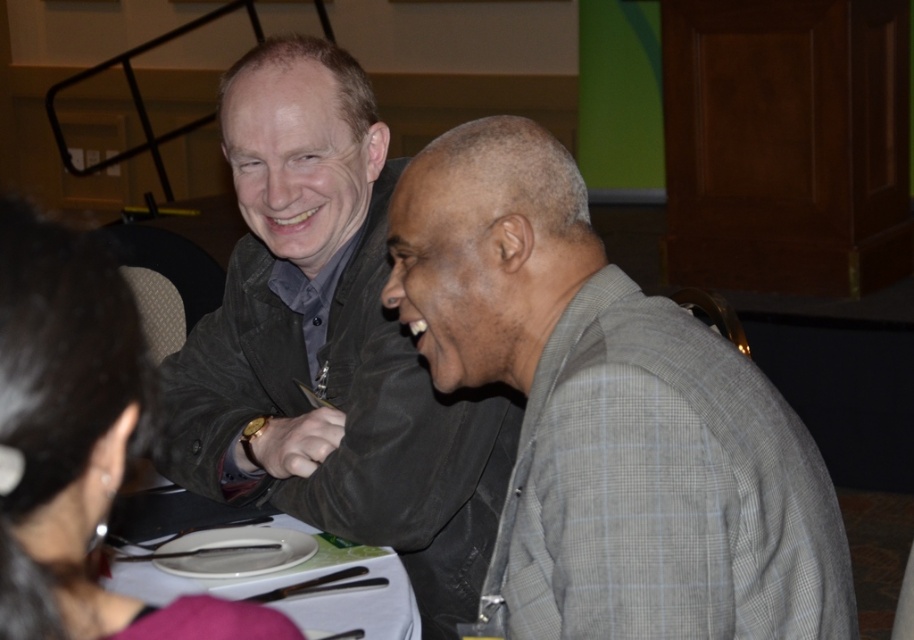
Which is more to the right, gray checkered suit at right or dark gray jacket at center?

gray checkered suit at right is more to the right.

Is gray checkered suit at right in front of dark gray jacket at center?

Yes, gray checkered suit at right is in front of dark gray jacket at center.

Does point (532, 193) lie behind point (330, 244)?

No, (532, 193) is closer to viewer.

The width and height of the screenshot is (914, 640). Find the location of `gray checkered suit at right`. gray checkered suit at right is located at coordinates (609, 417).

Does gray checkered suit at right have a smaller size compared to white glossy plate at center?

No, gray checkered suit at right is not smaller than white glossy plate at center.

Who is more distant from viewer, (676, 362) or (288, 604)?

Positioned behind is point (288, 604).

At what (x,y) coordinates should I click in order to perform the action: click on gray checkered suit at right. Please return your answer as a coordinate pair (x, y). Looking at the image, I should click on (609, 417).

What are the coordinates of `gray checkered suit at right` in the screenshot? It's located at (609, 417).

Between dark gray jacket at center and white glossy plate at center, which one is positioned higher?

dark gray jacket at center is higher up.

Is point (294, 115) closer to camera compared to point (331, 557)?

No, (294, 115) is further to viewer.

Identify the location of dark gray jacket at center. (331, 344).